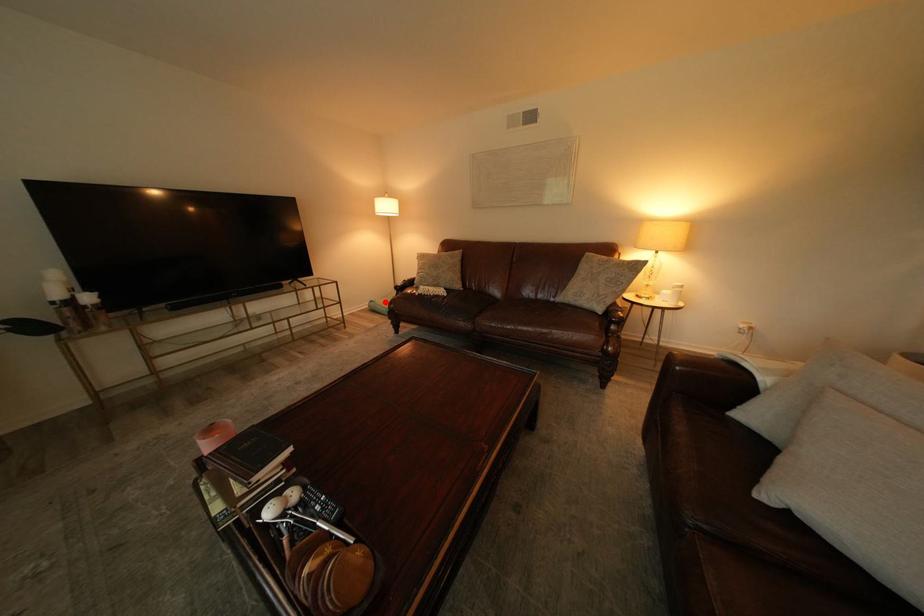
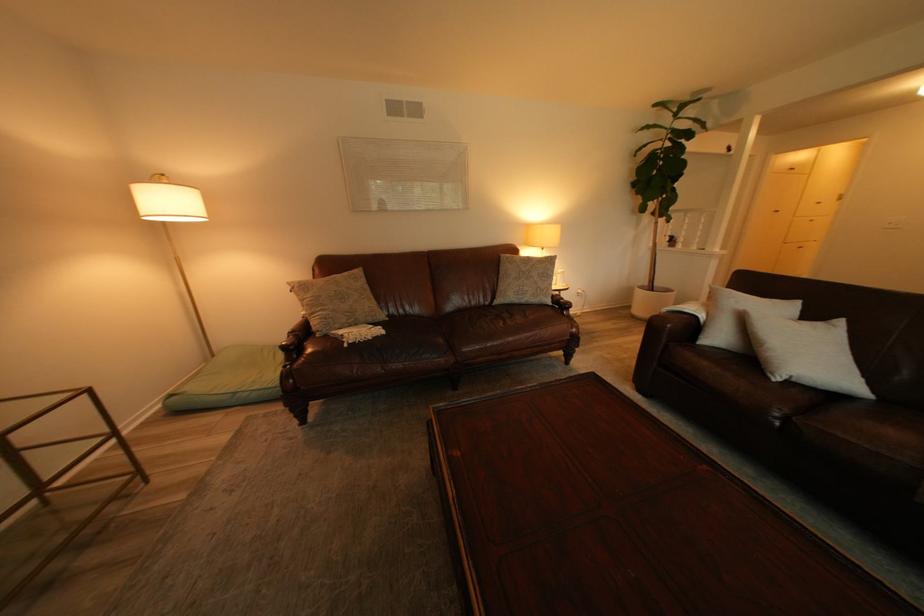
Question: I am providing you with two images of the same scene from different viewpoints. In image1, a red point is highlighted. Considering the same 3D point in image2, which of the following is correct?

Choices:
 (A) It is closer
 (B) It is farther

Answer: (A)